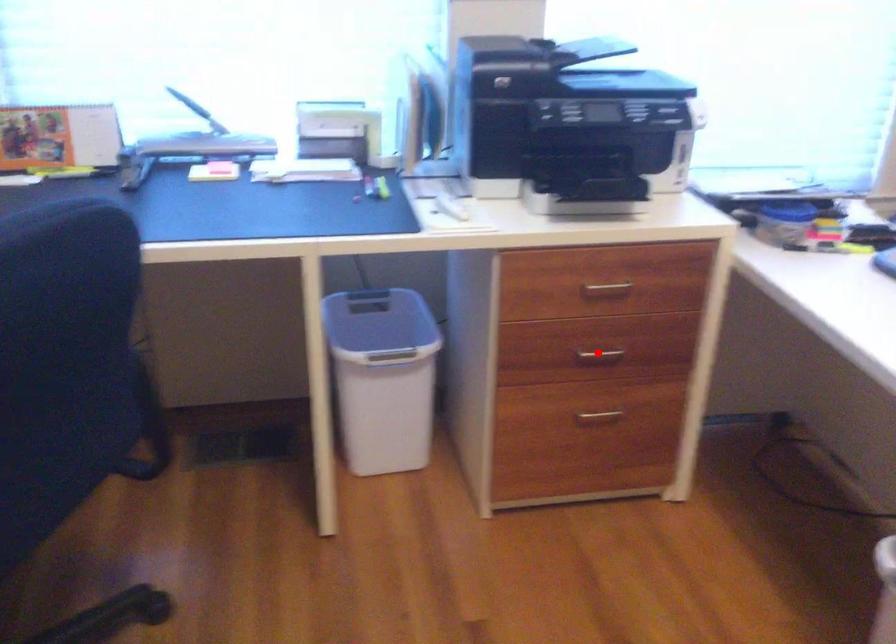
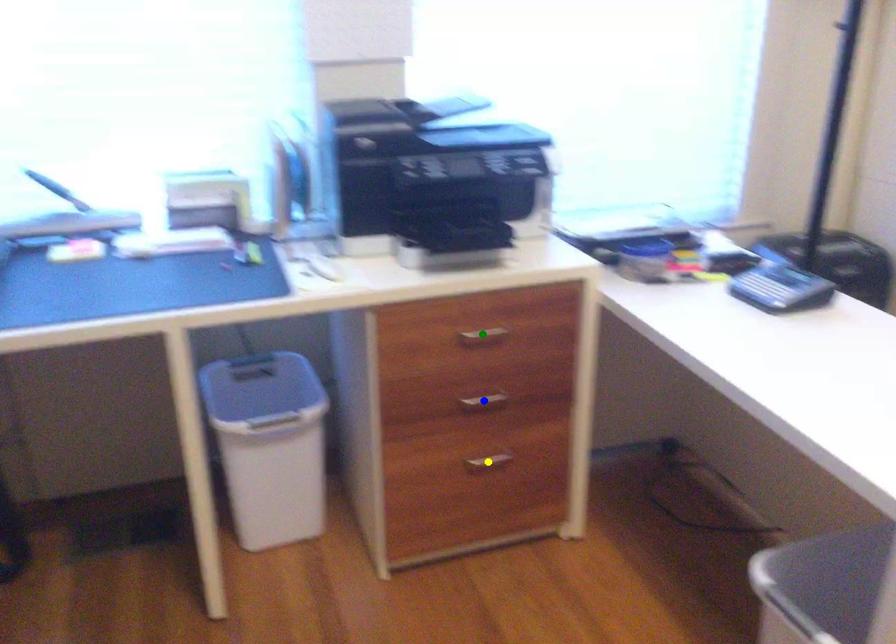
Question: I am providing you with two images of the same scene from different viewpoints. A red point is marked on the first image. You are given multiple points on the second image. Which mark in image 2 goes with the point in image 1?

Choices:
 (A) blue point
 (B) yellow point
 (C) green point

Answer: (A)